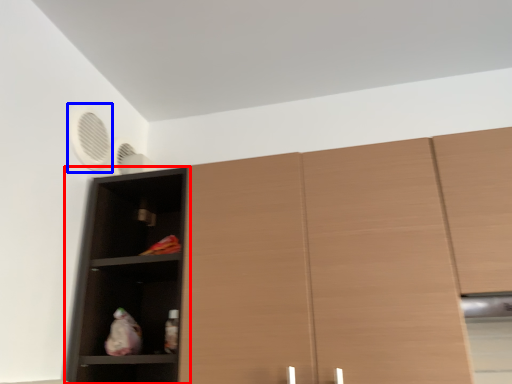
Question: Which of the following is the farthest to the observer, shelf (highlighted by a red box) or fan (highlighted by a blue box)?

Choices:
 (A) shelf
 (B) fan

Answer: (B)